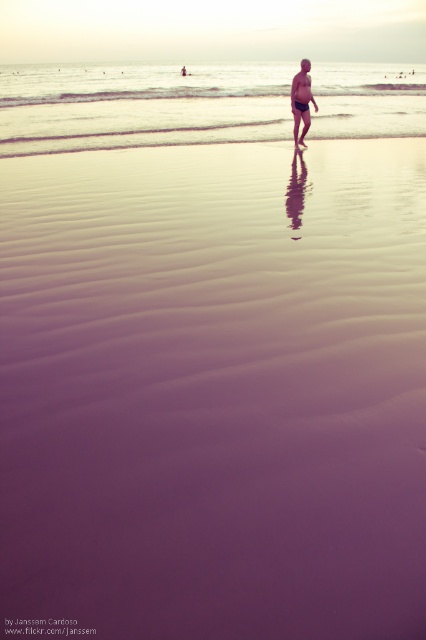
Question: Is clear water at center to the left of matte black swim trunks at center from the viewer's perspective?

Choices:
 (A) no
 (B) yes

Answer: (B)

Question: Which point is farther to the camera?

Choices:
 (A) clear water at center
 (B) matte black swim trunks at center

Answer: (A)

Question: Which point appears closest to the camera in this image?

Choices:
 (A) (3, 68)
 (B) (291, 86)

Answer: (B)

Question: Is clear water at center below matte black swim trunks at center?

Choices:
 (A) no
 (B) yes

Answer: (A)

Question: Considering the relative positions of clear water at center and matte black swim trunks at center in the image provided, where is clear water at center located with respect to matte black swim trunks at center?

Choices:
 (A) left
 (B) right

Answer: (A)